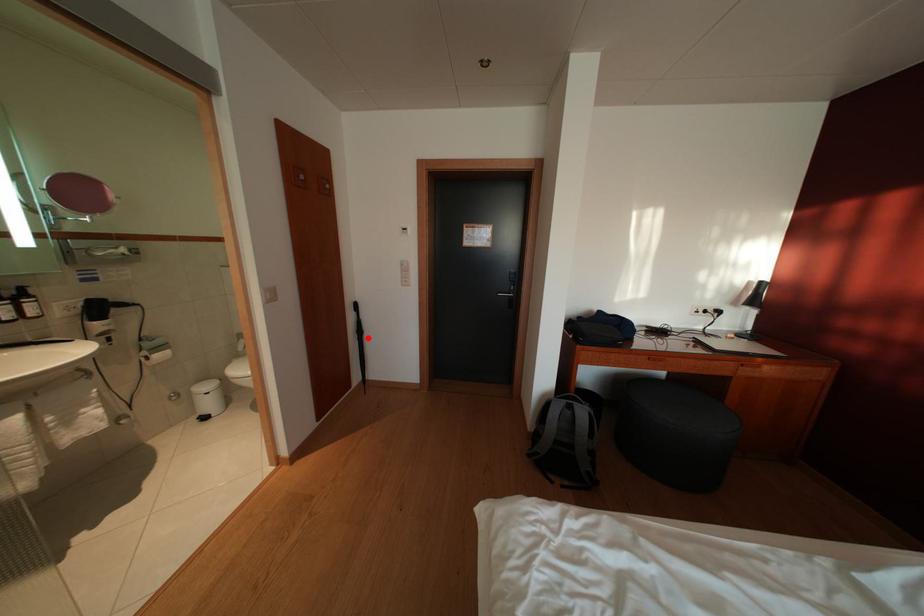
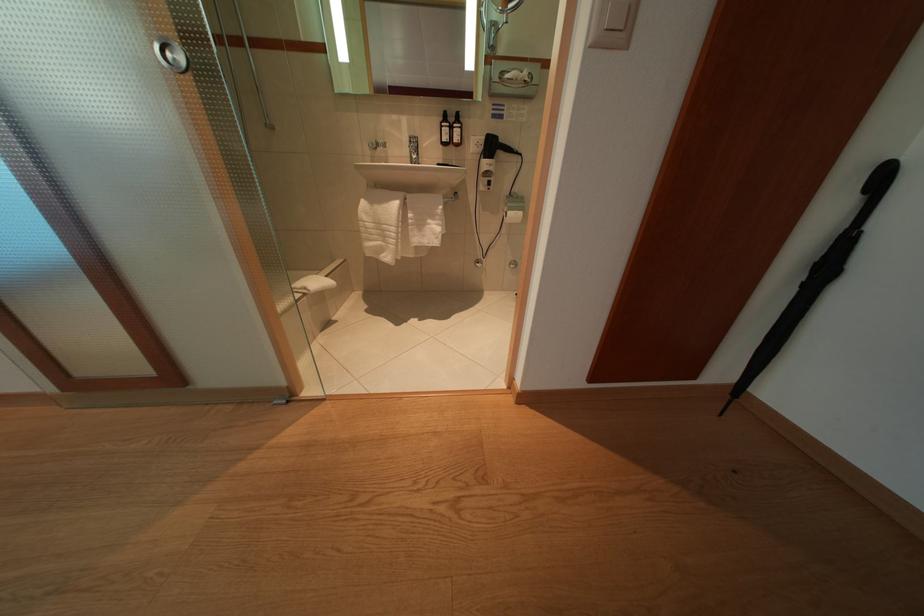
Question: I am providing you with two images of the same scene from different viewpoints. Given a red point in image1, look at the same physical point in image2. Is it:

Choices:
 (A) Closer to the viewpoint
 (B) Farther from the viewpoint

Answer: (B)